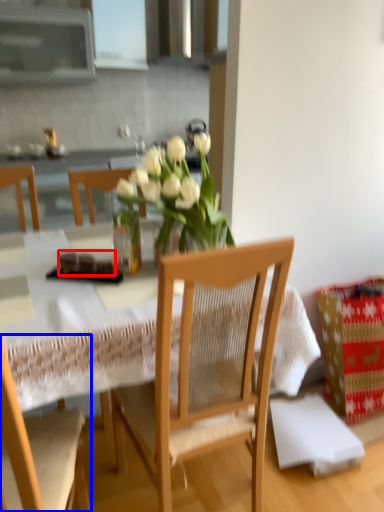
Question: Among these objects, which one is farthest to the camera, food (highlighted by a red box) or chair (highlighted by a blue box)?

Choices:
 (A) food
 (B) chair

Answer: (A)